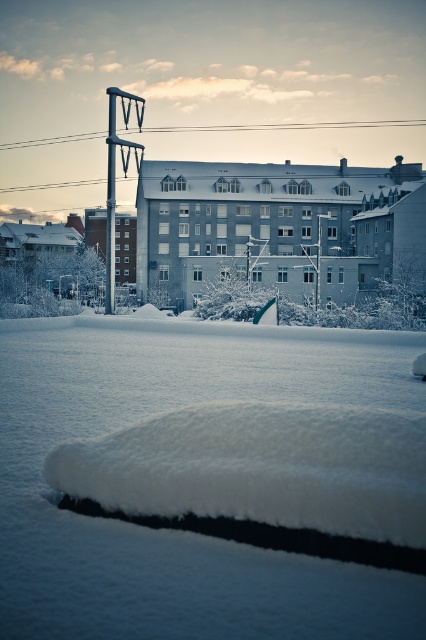
Does point (123, 371) come in front of point (333, 218)?

That is True.

Where is `white fluffy snow at center`? white fluffy snow at center is located at coordinates (175, 531).

Where is `white fluffy snow at center`? The image size is (426, 640). white fluffy snow at center is located at coordinates (175, 531).

Is point (314, 172) in front of point (74, 232)?

Yes, point (314, 172) is closer to viewer.

Is the position of gray concrete building at center less distant than that of snow-covered building at left?

Yes, it is in front of snow-covered building at left.

Is point (362, 196) positioned behind point (13, 248)?

No.

This screenshot has height=640, width=426. I want to click on gray concrete building at center, so click(279, 228).

Is point (143, 177) more distant than point (126, 221)?

No.

How distant is gray concrete building at center from brick building at center?

16.95 meters

This screenshot has width=426, height=640. What do you see at coordinates (279, 228) in the screenshot?
I see `gray concrete building at center` at bounding box center [279, 228].

Where is `gray concrete building at center`? The height and width of the screenshot is (640, 426). gray concrete building at center is located at coordinates (279, 228).